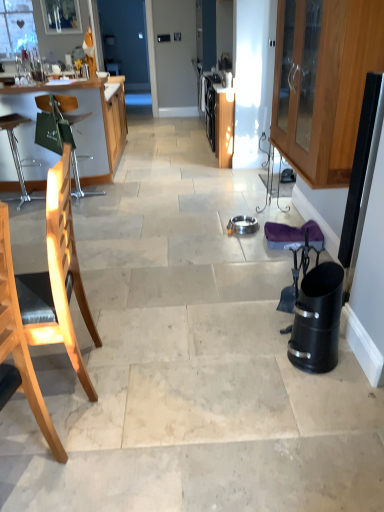
In order to click on vacant space behind light wood chair at left, which is the third chair from back to front in this screenshot , I will do `click(54, 426)`.